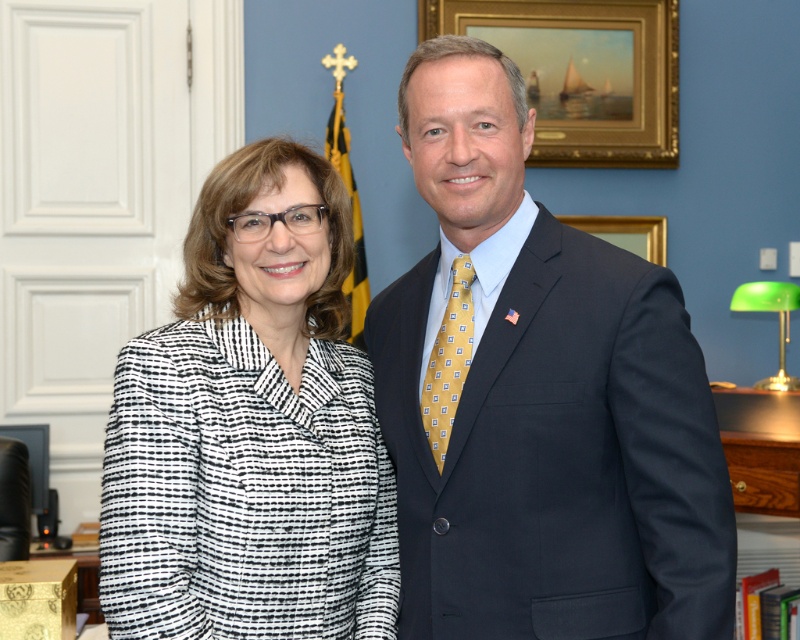
You are an interior designer assessing the office layout. The gold silk tie at center and the gold wooden picture frame at upper right are both gold accents. Which one is larger?

The gold wooden picture frame at upper right is larger than the gold silk tie at center.

You are an interior designer assessing the office layout. You notice the gold silk tie at center and the gold wooden picture frame at upper right. Which object has a greater height?

The gold silk tie at center is taller than the gold wooden picture frame at upper right.